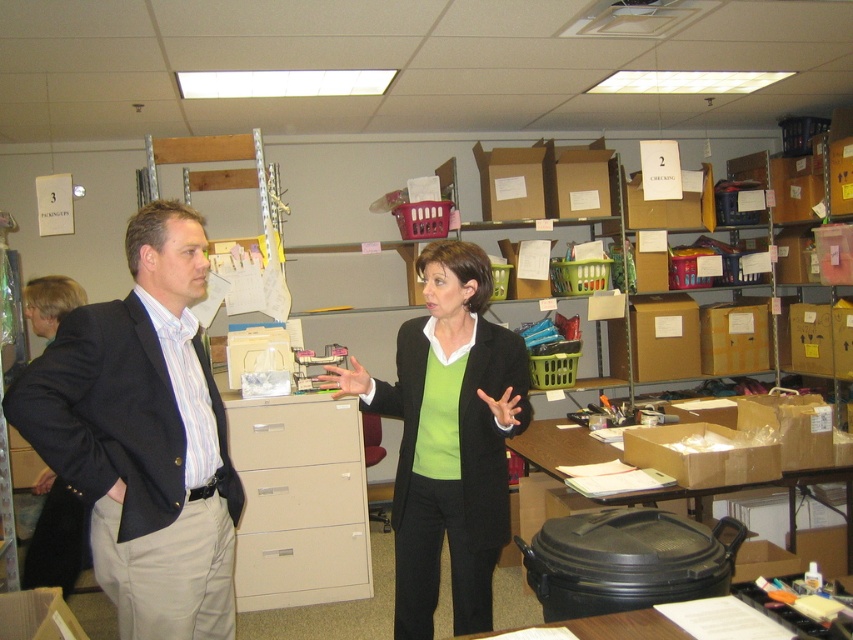
You are organizing supplies in the office and need to place a large box that requires 2 meters of space. The beige plastic file cabinet at center and the matte white drawer at center are in the way. Which object should you move to make more space?

The beige plastic file cabinet at center might be wider than the matte white drawer at center, so moving the beige plastic file cabinet at center could free up more space since it occupies a larger area.

You are standing in the office and want to hand a document to both the dark blue suit at center and the green matte blazer at center. Which one should you approach first to ensure you can reach them both without moving around any obstacles?

You should approach the dark blue suit at center first since it is closer to you than the green matte blazer at center, allowing you to reach both without needing to move around obstacles.